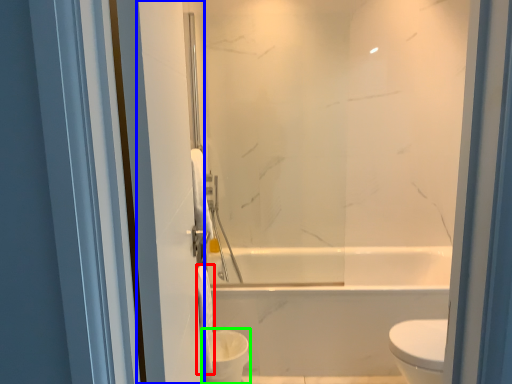
Question: Which object is positioned closest to toilet paper (highlighted by a red box)? Select from screen door (highlighted by a blue box) and toilet bowl (highlighted by a green box).

Choices:
 (A) screen door
 (B) toilet bowl

Answer: (B)